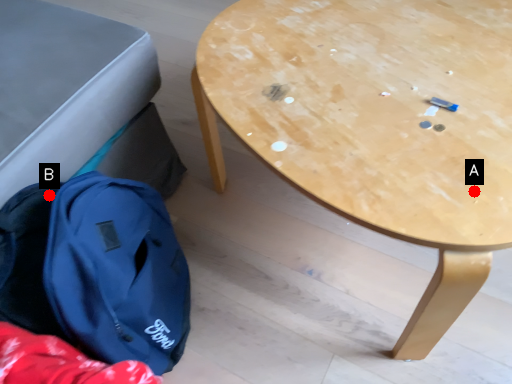
Question: Two points are circled on the image, labeled by A and B beside each circle. Which point is closer to the camera?

Choices:
 (A) A is closer
 (B) B is closer

Answer: (A)